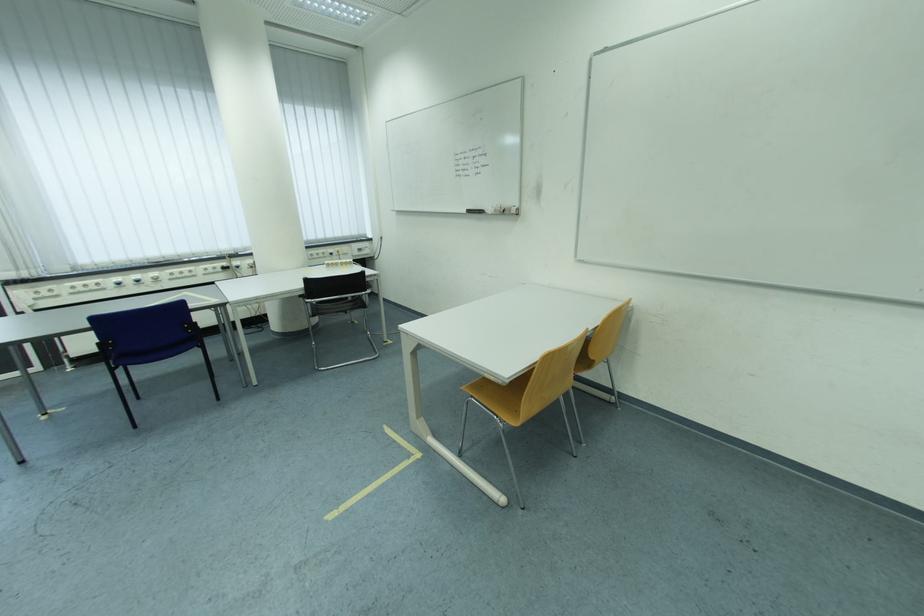
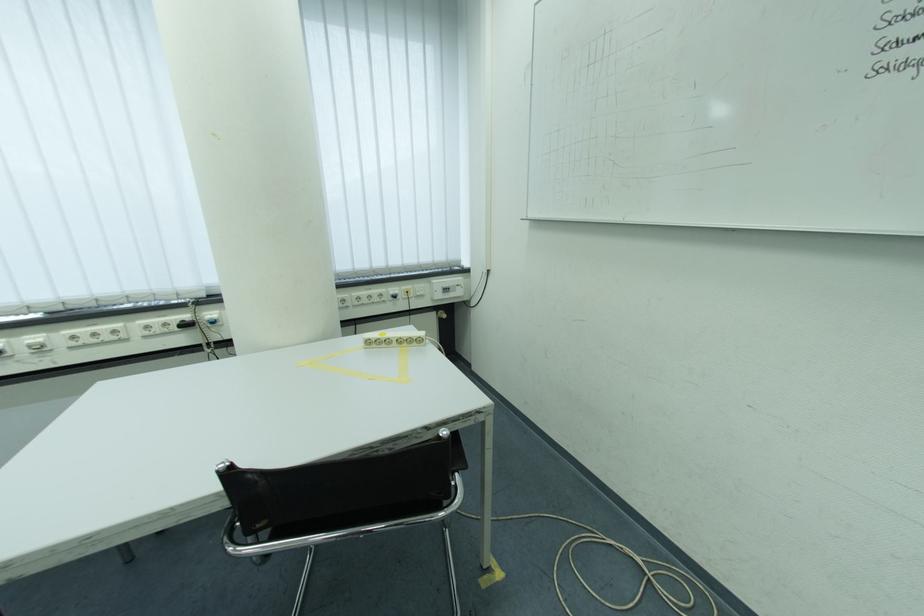
Find the pixel in the second image that matches (245,265) in the first image.

(217, 315)